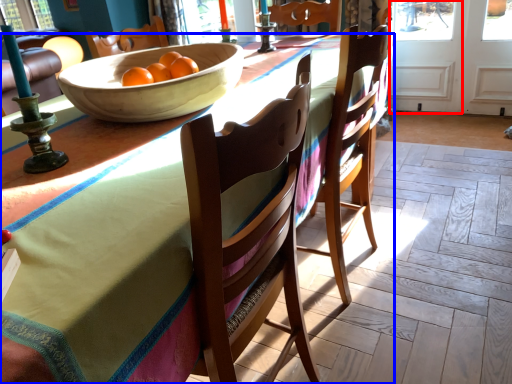
Question: Which of the following is the closest to the observer, screen door (highlighted by a red box) or desk (highlighted by a blue box)?

Choices:
 (A) screen door
 (B) desk

Answer: (B)